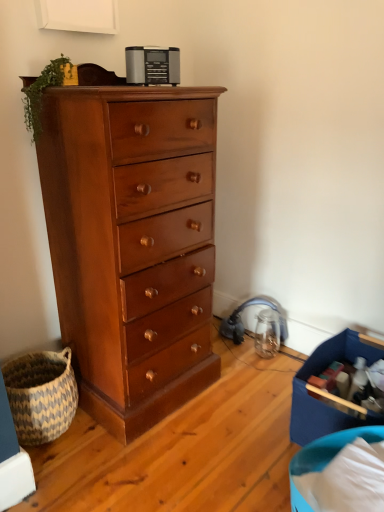
Question: From a real-world perspective, is blue fabric storage box at lower right on top of natural woven basket at lower left?

Choices:
 (A) yes
 (B) no

Answer: (A)

Question: Is blue fabric storage box at lower right oriented towards natural woven basket at lower left?

Choices:
 (A) yes
 (B) no

Answer: (B)

Question: From the image's perspective, is blue fabric storage box at lower right under natural woven basket at lower left?

Choices:
 (A) yes
 (B) no

Answer: (B)

Question: Considering the relative positions of blue fabric storage box at lower right and natural woven basket at lower left in the image provided, is blue fabric storage box at lower right behind natural woven basket at lower left?

Choices:
 (A) no
 (B) yes

Answer: (A)

Question: Considering the relative sizes of blue fabric storage box at lower right and natural woven basket at lower left in the image provided, is blue fabric storage box at lower right thinner than natural woven basket at lower left?

Choices:
 (A) yes
 (B) no

Answer: (B)

Question: From a real-world perspective, is blue fabric storage box at lower right physically located above or below shiny brown wood chest of drawers at left?

Choices:
 (A) below
 (B) above

Answer: (A)

Question: In terms of size, does blue fabric storage box at lower right appear bigger or smaller than shiny brown wood chest of drawers at left?

Choices:
 (A) small
 (B) big

Answer: (A)

Question: Is blue fabric storage box at lower right situated inside shiny brown wood chest of drawers at left or outside?

Choices:
 (A) outside
 (B) inside

Answer: (A)

Question: Considering their positions, is blue fabric storage box at lower right located in front of or behind shiny brown wood chest of drawers at left?

Choices:
 (A) front
 (B) behind

Answer: (B)

Question: In the image, is blue fabric storage box at lower right on the left side or the right side of satin silver radio at upper center?

Choices:
 (A) right
 (B) left

Answer: (A)

Question: Is blue fabric storage box at lower right wider or thinner than satin silver radio at upper center?

Choices:
 (A) thin
 (B) wide

Answer: (B)

Question: Choose the correct answer: Is blue fabric storage box at lower right inside satin silver radio at upper center or outside it?

Choices:
 (A) outside
 (B) inside

Answer: (A)

Question: From the image's perspective, is blue fabric storage box at lower right above or below satin silver radio at upper center?

Choices:
 (A) below
 (B) above

Answer: (A)

Question: Considering their positions, is natural woven basket at lower left located in front of or behind shiny brown wood chest of drawers at left?

Choices:
 (A) front
 (B) behind

Answer: (B)

Question: From the image's perspective, is natural woven basket at lower left positioned above or below shiny brown wood chest of drawers at left?

Choices:
 (A) below
 (B) above

Answer: (A)